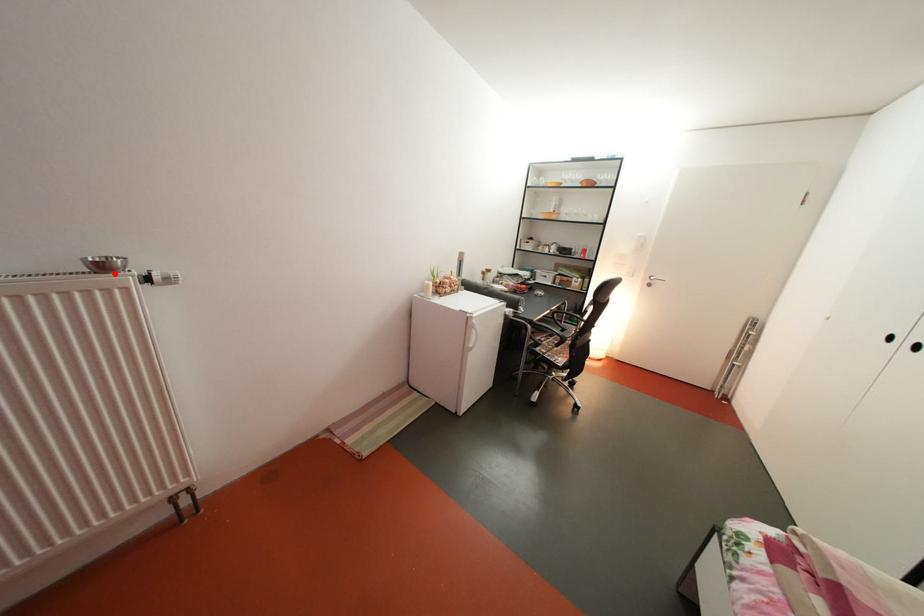
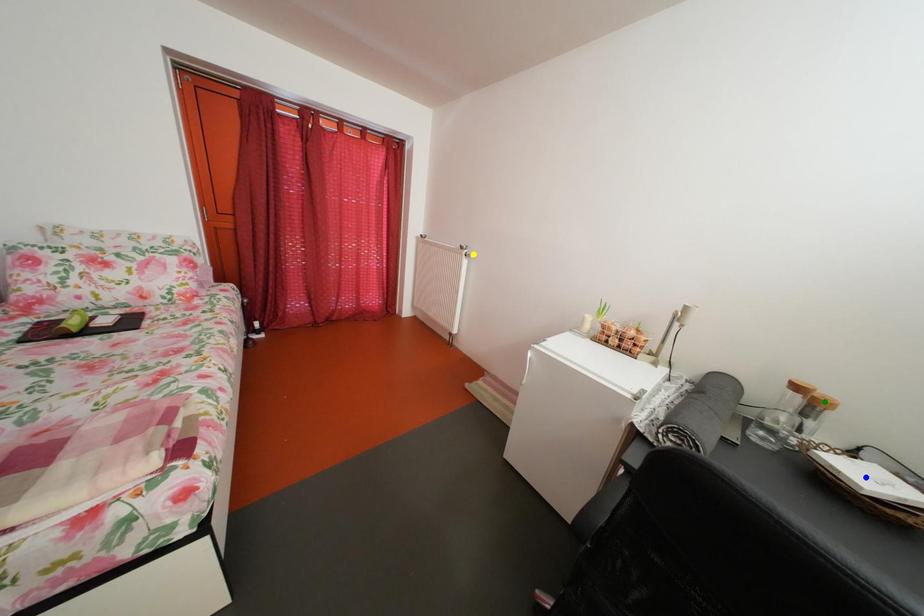
Question: I am providing you with two images of the same scene from different viewpoints. A red point is marked on the first image. You are given multiple points on the second image. Which point in image 2 is actually the same real-world point as the red point in image 1?

Choices:
 (A) blue point
 (B) yellow point
 (C) green point

Answer: (B)